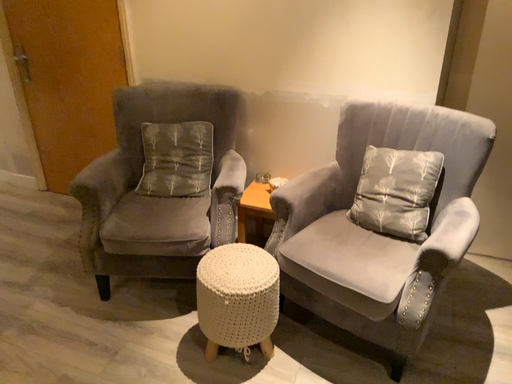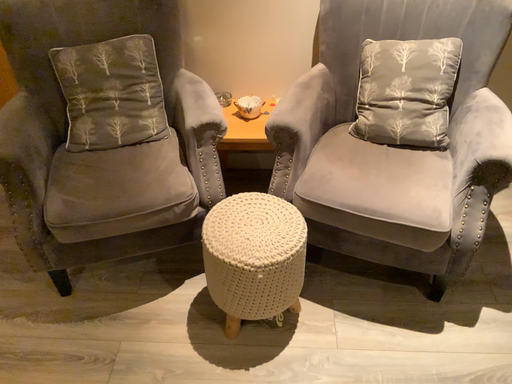
Question: Which way did the camera rotate in the video?

Choices:
 (A) rotated right
 (B) rotated left

Answer: (A)